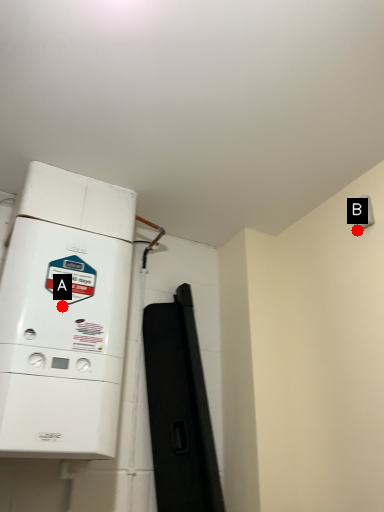
Question: Two points are circled on the image, labeled by A and B beside each circle. Which point is further to the camera?

Choices:
 (A) A is further
 (B) B is further

Answer: (B)